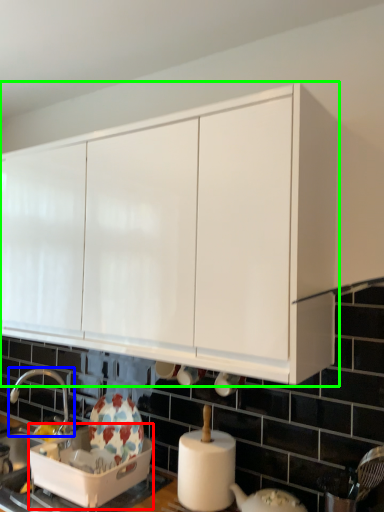
Question: Considering the real-world distances, which object is farthest from appliance (highlighted by a red box)? tap (highlighted by a blue box) or cabinetry (highlighted by a green box)?

Choices:
 (A) tap
 (B) cabinetry

Answer: (B)